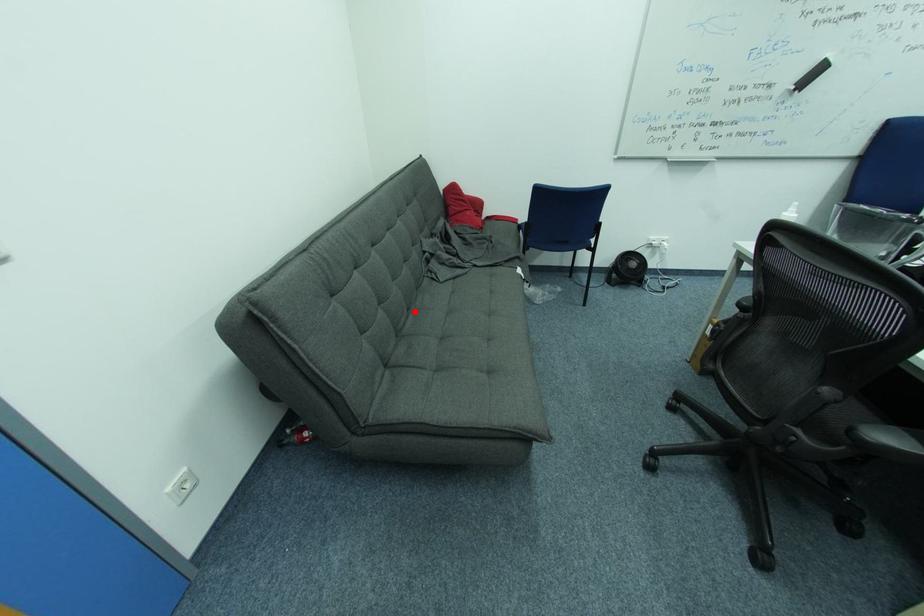
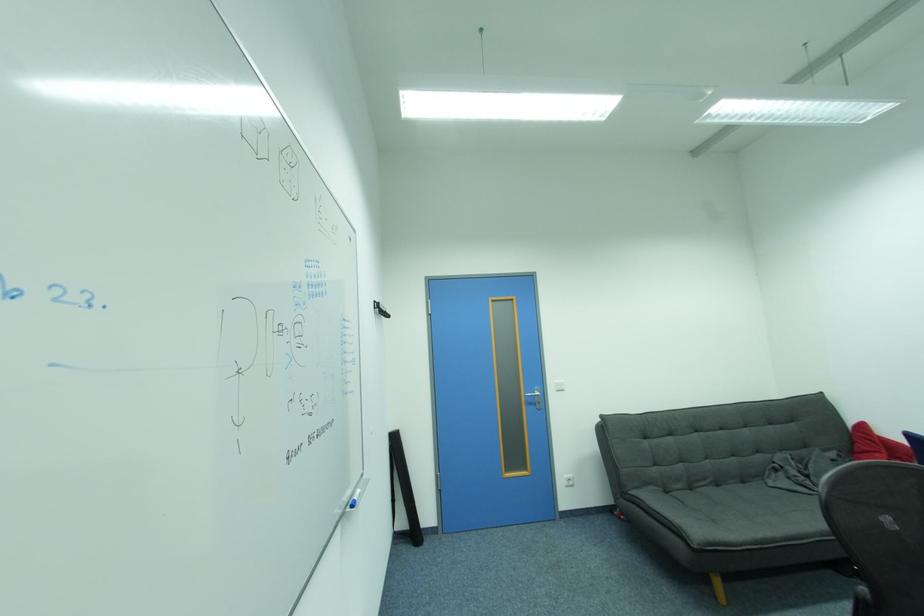
The point at the highlighted location is marked in the first image. Where is the corresponding point in the second image?

(723, 487)